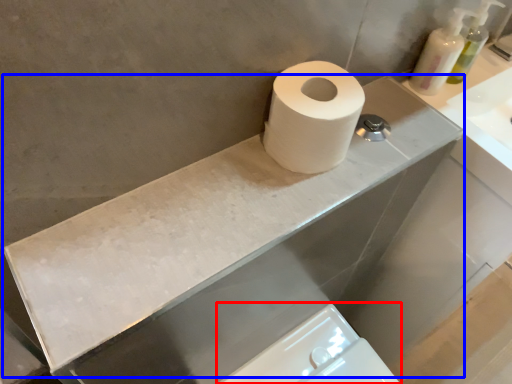
Question: Which point is closer to the camera, bidet (highlighted by a red box) or counter top (highlighted by a blue box)?

Choices:
 (A) bidet
 (B) counter top

Answer: (B)